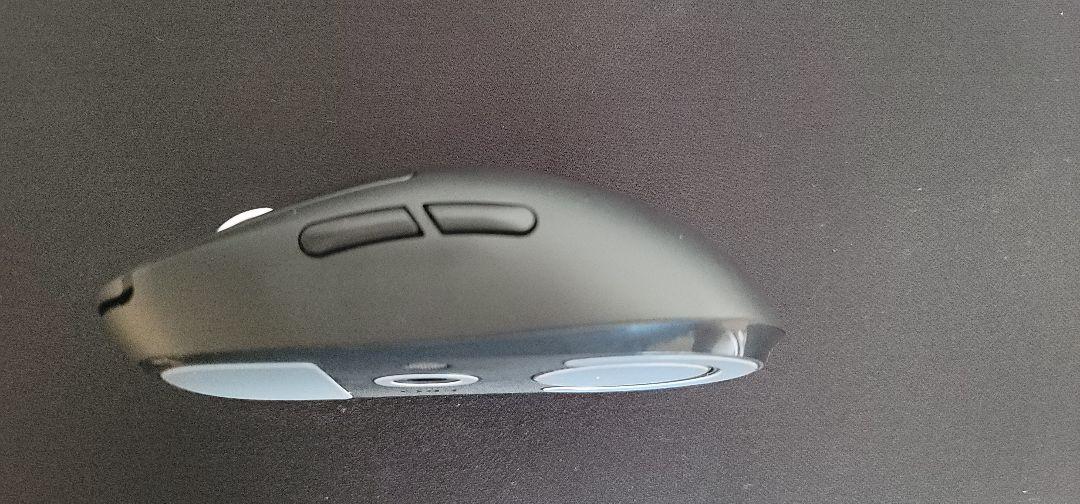
Identify the location of top of mouse. (475, 168).